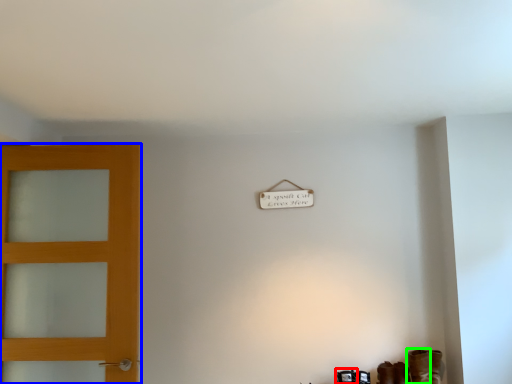
Question: Which is farther away from shoe (highlighted by a red box)? door (highlighted by a blue box) or boot (highlighted by a green box)?

Choices:
 (A) door
 (B) boot

Answer: (A)